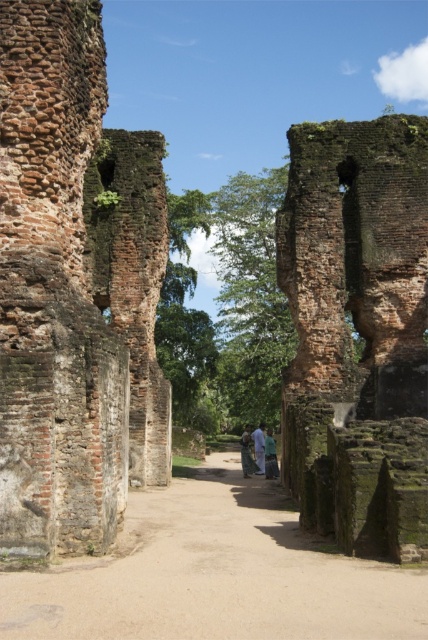
You are standing at the entrance of the ruins and want to reach the rusty brick ruins at left. If your walking speed is 1.5 meters per second, how many seconds will it take you to reach them?

The distance between you and the rusty brick ruins at left is 45.17 meters. At a walking speed of 1.5 meters per second, it would take approximately 30.11 seconds to reach them.

You are a photographer planning to capture a photo of the green fabric dress at center and the green fabric person at center in the ruins. Since both are green, you want to ensure they are distinguishable in the photo. Which object will appear taller in the final image?

The green fabric dress at center is taller than the green fabric person at center, so it will appear taller in the photo.